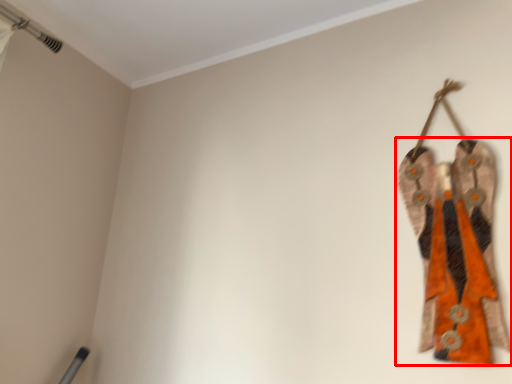
Question: Observing the image, what is the correct spatial positioning of fancy dress (annotated by the red box) in reference to trim?

Choices:
 (A) left
 (B) right

Answer: (B)